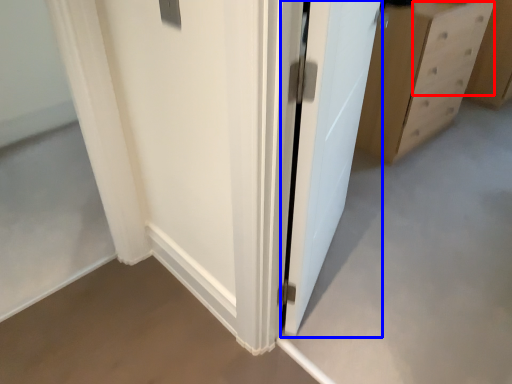
Question: Which object is closer to the camera taking this photo, drawer (highlighted by a red box) or door (highlighted by a blue box)?

Choices:
 (A) drawer
 (B) door

Answer: (B)